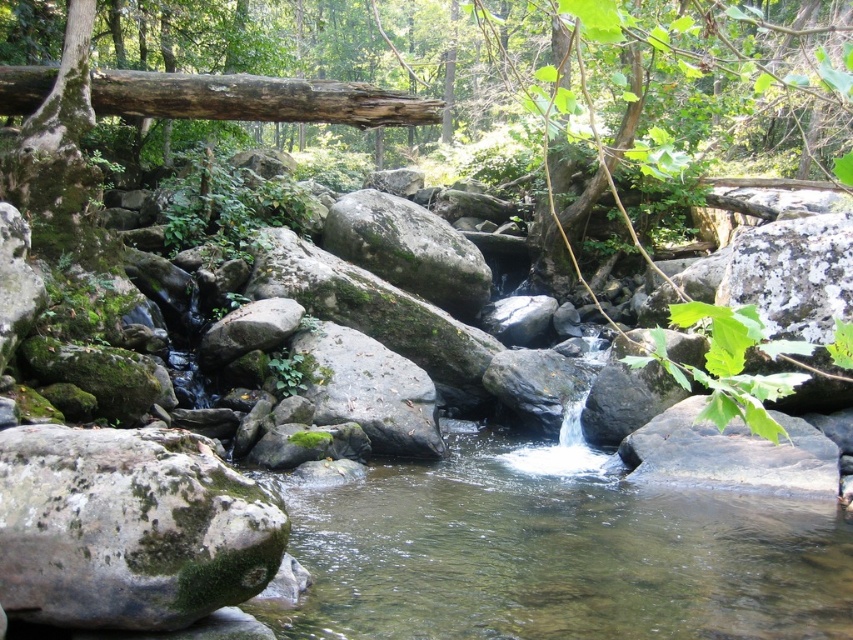
Based on the photo, you are a hiker who needs to cross the stream. You see a brown rough log at upper left and a smooth gray rock at lower right. Which object is farther away from you?

The brown rough log at upper left is farther away from the smooth gray rock at lower right by 5.83 meters, so the brown rough log at upper left is farther away.

Looking at this image, you are a hiker trying to cross the stream. You see the green mossy rock at lower left and the green mossy rock at center. Which rock should you step on first to reach the other side?

You should step on the green mossy rock at lower left first because it is closer to you and positioned in front of the green mossy rock at center, making it the first stable footing when crossing the stream.

You are a hiker trying to cross the stream. You notice two rocks in the water. The green mossy rock at lower left and the smooth gray rock at lower right. Which rock is closer to the left bank of the stream?

The green mossy rock at lower left is positioned on the left side of smooth gray rock at lower right, so it is closer to the left bank of the stream.